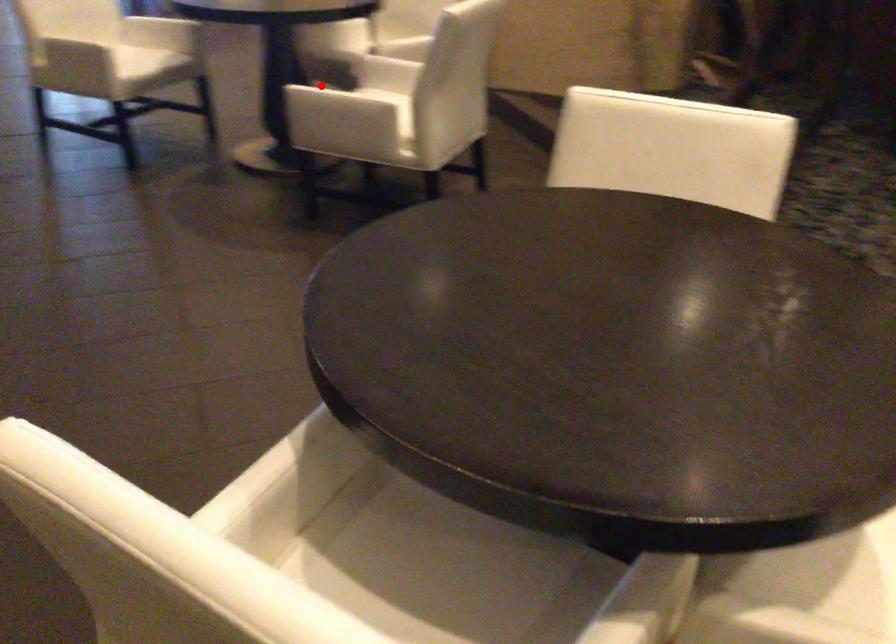
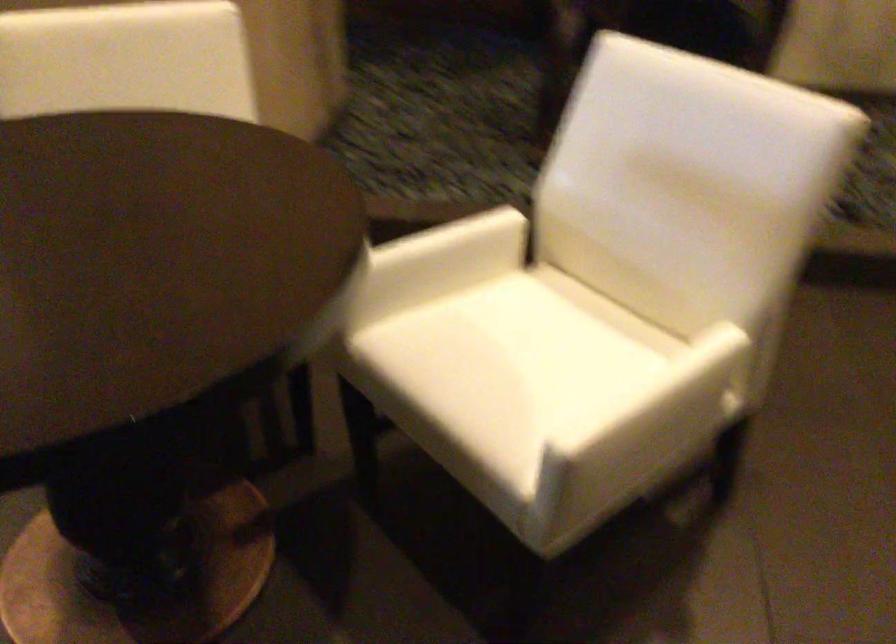
Question: I am providing you with two images of the same scene from different viewpoints. In image1, a red point is highlighted. Considering the same 3D point in image2, which of the following is correct?

Choices:
 (A) It is closer
 (B) It is farther

Answer: (A)